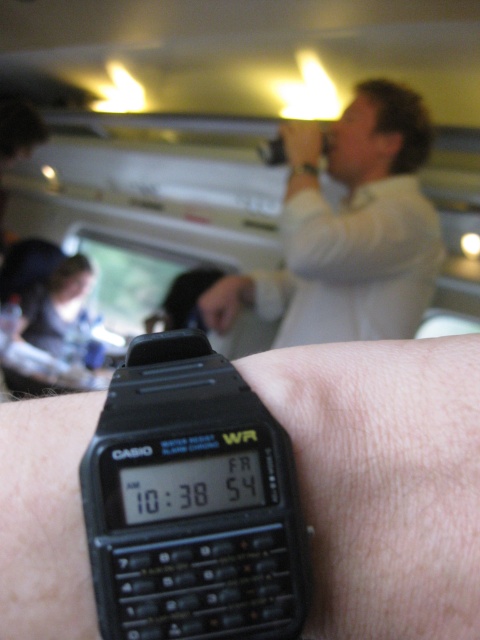
You are a passenger on the train and you want to check the time on the black plastic watch at center and the black plastic calculator at center. Which one is located more to the right side?

The black plastic watch at center is located to the right of the black plastic calculator at center, so it is more to the right side.

You are a photographer trying to capture both the black plastic watch at center and the white matte shirt at upper center in a single photo. Which object will appear larger in the photo?

The black plastic watch at center will appear larger in the photo because it is closer to the viewer than the white matte shirt at upper center.

You are inside a train car and want to know if the point at coordinates point (17, 627) is closer to the front of the train than point (222, 548). Based on the scene description, can you determine which point is closer to the front?

Point (222, 548) is closer to the front of the train because it is in front of point (17, 627) according to the spatial relationship provided.